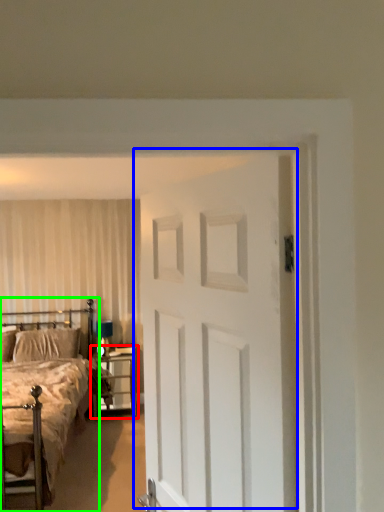
Question: Which object is the farthest from nightstand (highlighted by a red box)? Choose among these: door (highlighted by a blue box) or bed (highlighted by a green box).

Choices:
 (A) door
 (B) bed

Answer: (A)